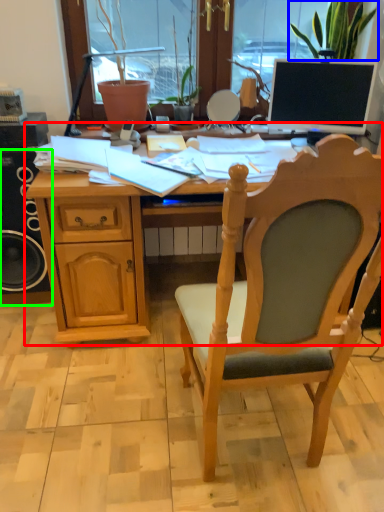
Question: Which is farther away from desk (highlighted by a red box)? houseplant (highlighted by a blue box) or loudspeaker (highlighted by a green box)?

Choices:
 (A) houseplant
 (B) loudspeaker

Answer: (A)